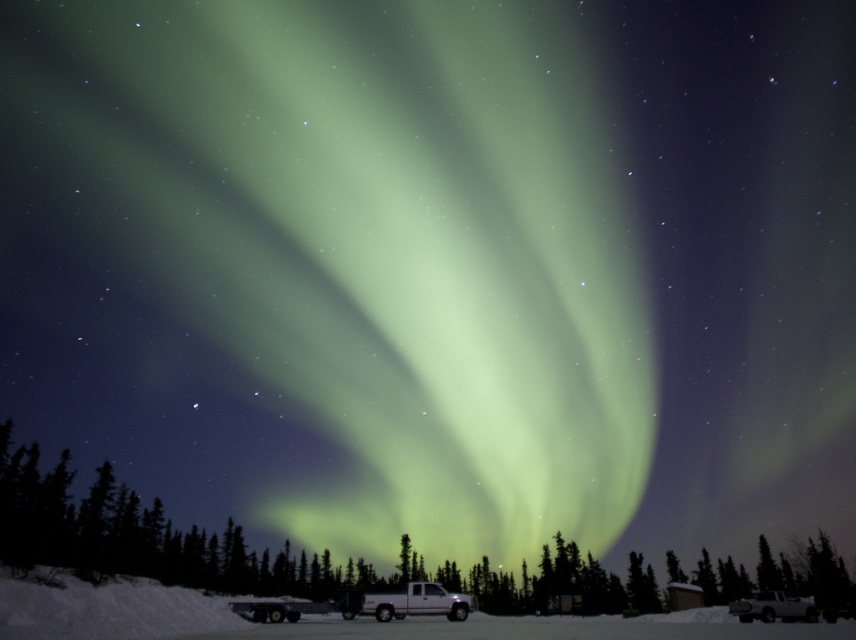
Question: Which object appears closest to the camera in this image?

Choices:
 (A) green matte tree at center
 (B) white matte van at center

Answer: (A)

Question: Which point is closer to the camera taking this photo?

Choices:
 (A) click(440, 595)
 (B) click(753, 595)

Answer: (A)

Question: Based on their relative distances, which object is nearer to the white matte van at center?

Choices:
 (A) white matte truck at lower right
 (B) green matte tree at center

Answer: (A)

Question: Is white matte van at center wider than white matte truck at lower right?

Choices:
 (A) no
 (B) yes

Answer: (A)

Question: Is the position of green matte tree at center less distant than that of white matte truck at lower right?

Choices:
 (A) no
 (B) yes

Answer: (B)

Question: Does green matte tree at center have a smaller size compared to white matte truck at lower right?

Choices:
 (A) no
 (B) yes

Answer: (A)